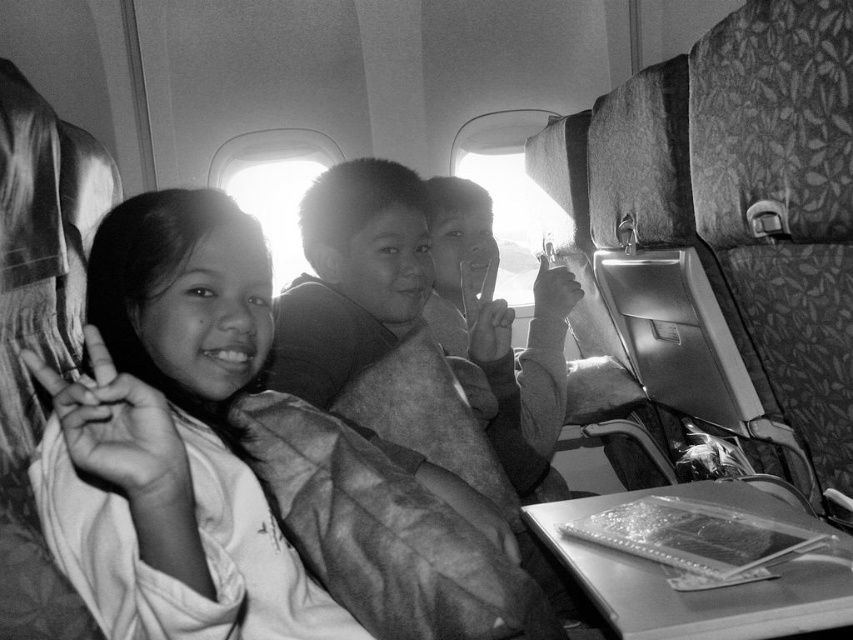
You are a flight attendant checking seatbelts. You notice the smooth fabric shirt at left and the smooth skin child at center. Which object is closer to the floor?

The smooth fabric shirt at left is positioned under the smooth skin child at center, so it is closer to the floor.

Looking at the airplane cabin scene, you notice a smooth fabric shirt at left and a smooth skin child at center. Which object is positioned to the left of the other?

The smooth fabric shirt at left is to the left of smooth skin child at center.

You are a flight attendant standing at the back of the airplane cabin. You need to reach a specific point marked at coordinates point (x=250, y=628). If your reach extends 1 meter forward, can you touch that point without moving closer?

The distance of point (x=250, y=628) from camera is 1.07 meters, so the flight attendant cannot touch the point with a 1 meter reach since it is slightly farther away.